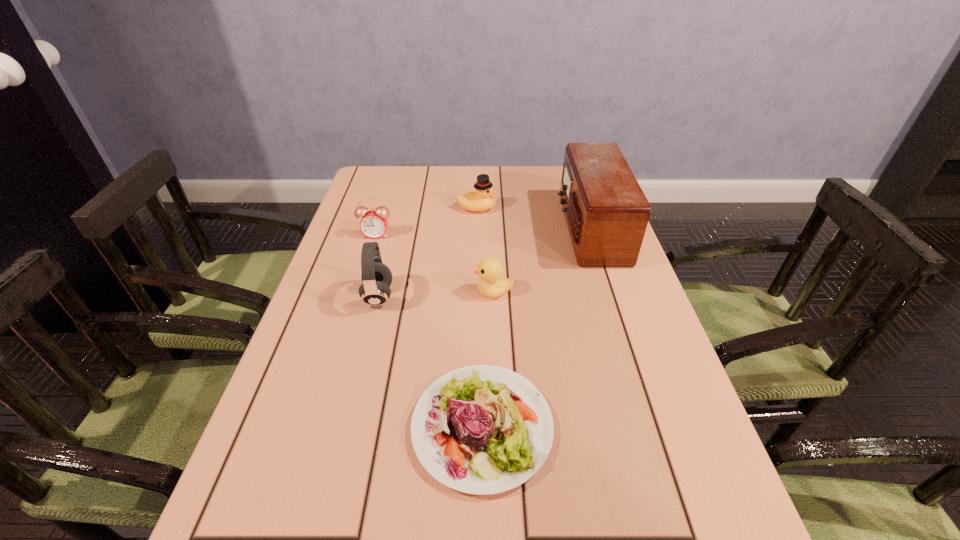
At what (x,y) coordinates should I click in order to perform the action: click on free spot between the farther duck and the alarm clock. Please return your answer as a coordinate pair (x, y). The height and width of the screenshot is (540, 960). Looking at the image, I should click on (426, 221).

Image resolution: width=960 pixels, height=540 pixels. Identify the location of free point between the alarm clock and the rightmost object. (483, 232).

The width and height of the screenshot is (960, 540). In order to click on vacant space in between the tallest object and the nearer duck in this screenshot , I will do `click(541, 260)`.

At what (x,y) coordinates should I click in order to perform the action: click on unoccupied position between the radio receiver and the shortest object. Please return your answer as a coordinate pair (x, y). Image resolution: width=960 pixels, height=540 pixels. Looking at the image, I should click on (536, 328).

Locate an element on the screen. The width and height of the screenshot is (960, 540). unoccupied position between the salad plate and the headset is located at coordinates (430, 361).

This screenshot has width=960, height=540. What are the coordinates of `unoccupied position between the nearer duck and the salad plate` in the screenshot? It's located at (488, 359).

This screenshot has height=540, width=960. In order to click on object that stands as the fifth closest to the fifth shortest object in this screenshot , I will do `click(606, 211)`.

Find the location of a particular element. This screenshot has width=960, height=540. object that can be found as the second closest to the headset is located at coordinates (481, 429).

Find the location of a particular element. This screenshot has width=960, height=540. free location that satisfies the following two spatial constraints: 1. on the ear cups of the nearest object; 2. on the left side of the second tallest object is located at coordinates (346, 427).

Image resolution: width=960 pixels, height=540 pixels. I want to click on free space that satisfies the following two spatial constraints: 1. on the clock face of the alarm clock; 2. on the left side of the salad plate, so click(x=318, y=427).